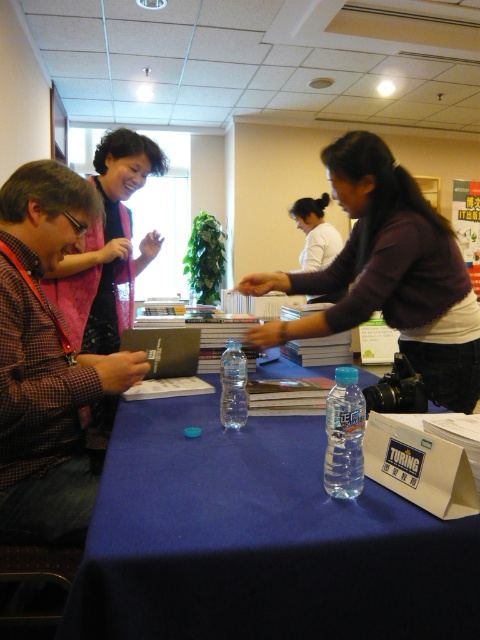
Question: Which object is the closest to the clear plastic water bottle at center?

Choices:
 (A) dark brown sweater at center
 (B) blue fabric tablecloth at center
 (C) clear plastic bottle at table center

Answer: (B)

Question: Is brown checkered shirt at left wider than clear plastic bottle at table center?

Choices:
 (A) yes
 (B) no

Answer: (A)

Question: Which object appears farthest from the camera in this image?

Choices:
 (A) brown checkered shirt at left
 (B) blue fabric tablecloth at center
 (C) clear plastic bottle at table center
 (D) clear plastic water bottle at center

Answer: (C)

Question: Which of the following is the farthest from the observer?

Choices:
 (A) clear plastic water bottle at center
 (B) blue fabric tablecloth at center
 (C) brown checkered shirt at left
 (D) clear plastic bottle at table center

Answer: (D)

Question: Considering the relative positions of blue fabric tablecloth at center and dark brown sweater at center in the image provided, where is blue fabric tablecloth at center located with respect to dark brown sweater at center?

Choices:
 (A) left
 (B) right

Answer: (A)

Question: Is brown checkered shirt at left further to camera compared to clear plastic bottle at table center?

Choices:
 (A) no
 (B) yes

Answer: (A)